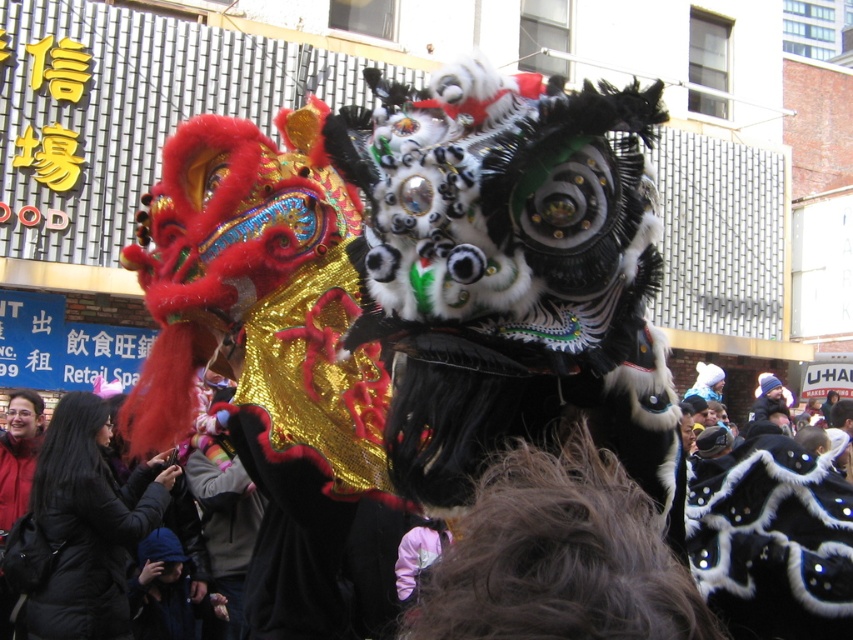
You are a photographer at the event and want to capture both the black sequined mask at center and the velvet black coat at lower left in a single frame. Which object should you focus on to ensure both are visible without zooming in or out?

The black sequined mask at center is wider than the velvet black coat at lower left. To capture both in a single frame without zooming, focus on the black sequined mask at center since its greater width allows the velvet black coat at lower left to fit within the same shot.

You are a photographer at the event and want to capture a photo of the black sequined mask at center without the velvet black coat at lower left blocking it. Is this possible based on their positions?

The black sequined mask at center is in front of the velvet black coat at lower left, so yes, it can be captured without obstruction from the coat.

You are a photographer standing at the center of the scene. You want to take a photo of the black sequined mask at center and the velvet black coat at lower left. Can you fit both objects in your camera frame if your camera has a maximum distance coverage of 15 meters between the nearest and farthest objects?

The black sequined mask at center is 16.82 meters away from the velvet black coat at lower left. Since the maximum distance coverage is 15 meters, the camera cannot capture both objects in a single frame as the distance exceeds the limit.